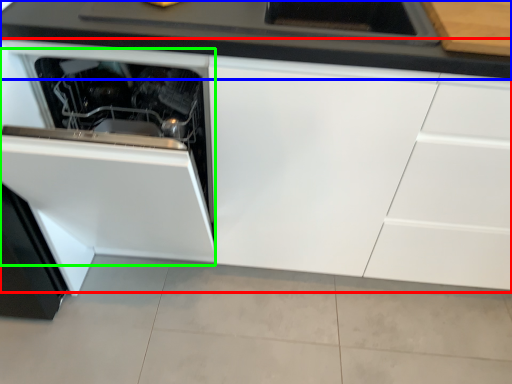
Question: Based on their relative distances, which object is nearer to cabinetry (highlighted by a red box)? Choose from countertop (highlighted by a blue box) and oven (highlighted by a green box).

Choices:
 (A) countertop
 (B) oven

Answer: (B)